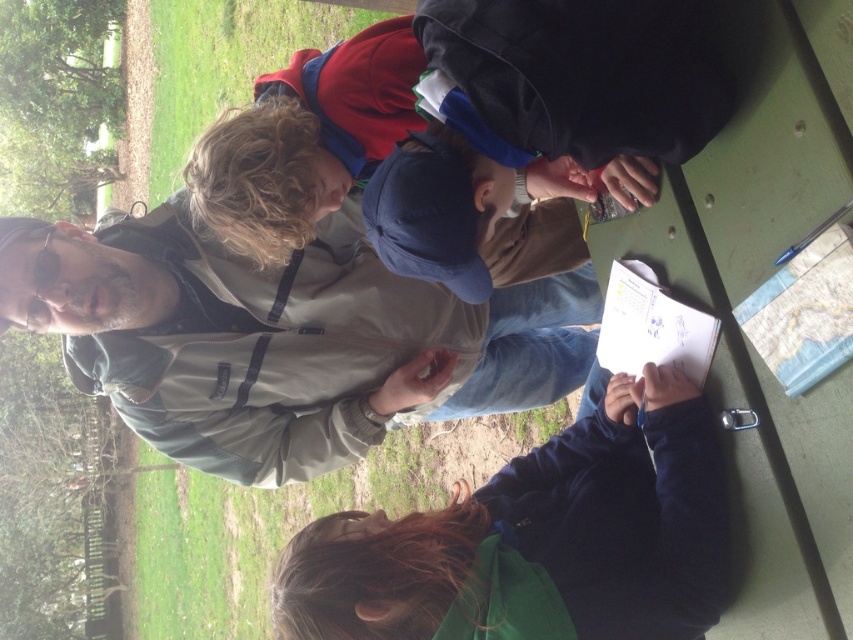
Is gray fabric jacket at upper left above dark brown hair at lower center?

Yes.

Find the location of a particular element. This screenshot has width=853, height=640. gray fabric jacket at upper left is located at coordinates (297, 333).

This screenshot has width=853, height=640. What are the coordinates of `gray fabric jacket at upper left` in the screenshot? It's located at (297, 333).